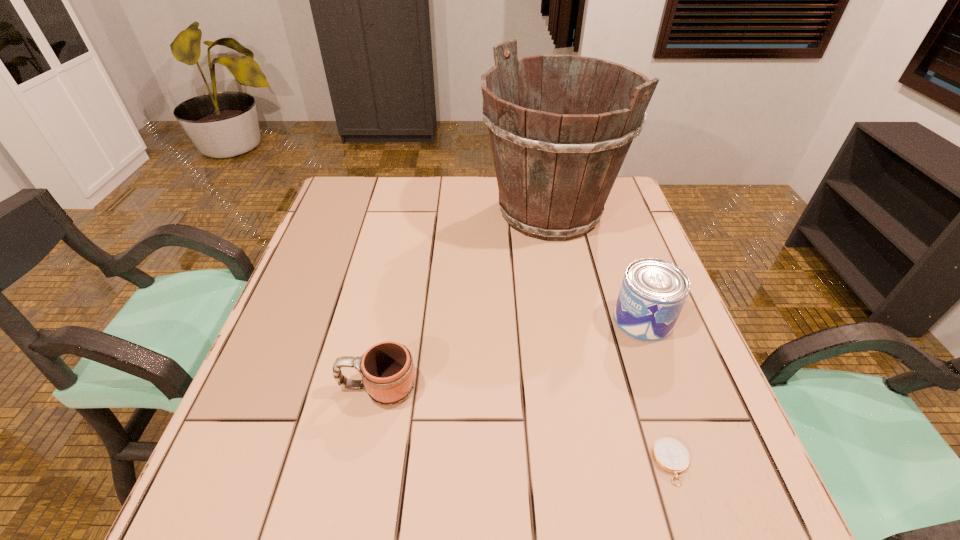
Locate an element on the screen. The image size is (960, 540). free space between the second tallest object and the farthest object is located at coordinates (596, 266).

You are a GUI agent. You are given a task and a screenshot of the screen. Output one action in this format:
    pyautogui.click(x=<x>, y=<y>)
    Task: Click on the unoccupied area between the second nearest object and the can
    The width and height of the screenshot is (960, 540).
    Given the screenshot: What is the action you would take?
    pyautogui.click(x=511, y=354)

Where is `vacant area that lies between the farthest object and the shortest object`? The width and height of the screenshot is (960, 540). vacant area that lies between the farthest object and the shortest object is located at coordinates (611, 337).

This screenshot has height=540, width=960. Identify the location of empty space between the nearest object and the farthest object. (611, 337).

Where is `vacant area that lies between the compass and the bucket`? vacant area that lies between the compass and the bucket is located at coordinates (611, 337).

Identify the location of vacant area between the second tallest object and the shortest object. This screenshot has height=540, width=960. (657, 391).

Where is `vacant space that is in between the leftmost object and the tallest object`? The height and width of the screenshot is (540, 960). vacant space that is in between the leftmost object and the tallest object is located at coordinates (464, 300).

This screenshot has width=960, height=540. Identify the location of free space between the compass and the bucket. (611, 337).

I want to click on object that stands as the second closest to the bucket, so click(388, 375).

At what (x,y) coordinates should I click in order to perform the action: click on the closest object to the second nearest object. Please return your answer as a coordinate pair (x, y). This screenshot has width=960, height=540. Looking at the image, I should click on (555, 171).